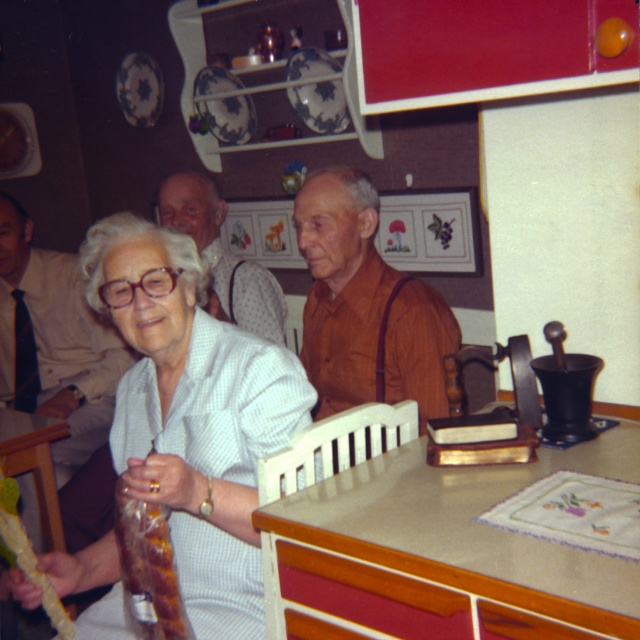
Can you confirm if white textured shirt at center is taller than white shirt at upper left?

In fact, white textured shirt at center may be shorter than white shirt at upper left.

Looking at this image, is white textured shirt at center below white shirt at upper left?

Correct, white textured shirt at center is located below white shirt at upper left.

Describe the element at coordinates (193, 413) in the screenshot. The height and width of the screenshot is (640, 640). I see `white textured shirt at center` at that location.

Locate an element on the screen. The image size is (640, 640). white textured shirt at center is located at coordinates (193, 413).

Can you confirm if beige laminate table at center is positioned below white textured shirt at center?

Yes.

Does beige laminate table at center have a larger size compared to white textured shirt at center?

Incorrect, beige laminate table at center is not larger than white textured shirt at center.

Who is more forward, (522, 477) or (182, 403)?

Positioned in front is point (522, 477).

Where is `beige laminate table at center`? The image size is (640, 640). beige laminate table at center is located at coordinates (440, 554).

Which of these two, beige laminate table at center or shiny brown meat at lower left, stands shorter?

With less height is shiny brown meat at lower left.

Which is in front, point (317, 513) or point (134, 592)?

Point (317, 513) is more forward.

This screenshot has height=640, width=640. Find the location of `beige laminate table at center`. beige laminate table at center is located at coordinates (440, 554).